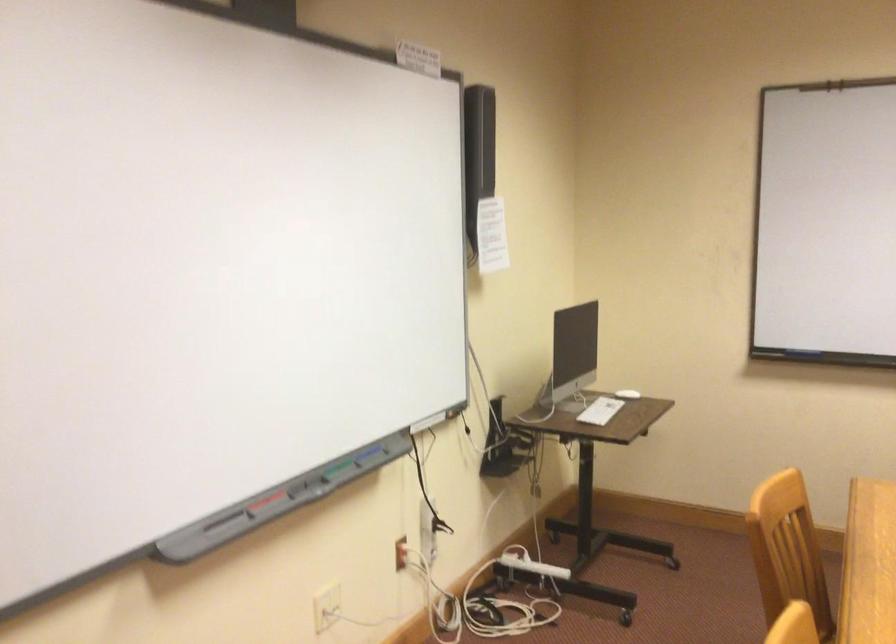
The location [600,410] corresponds to which object?

It corresponds to the white computer keyboard in the image.